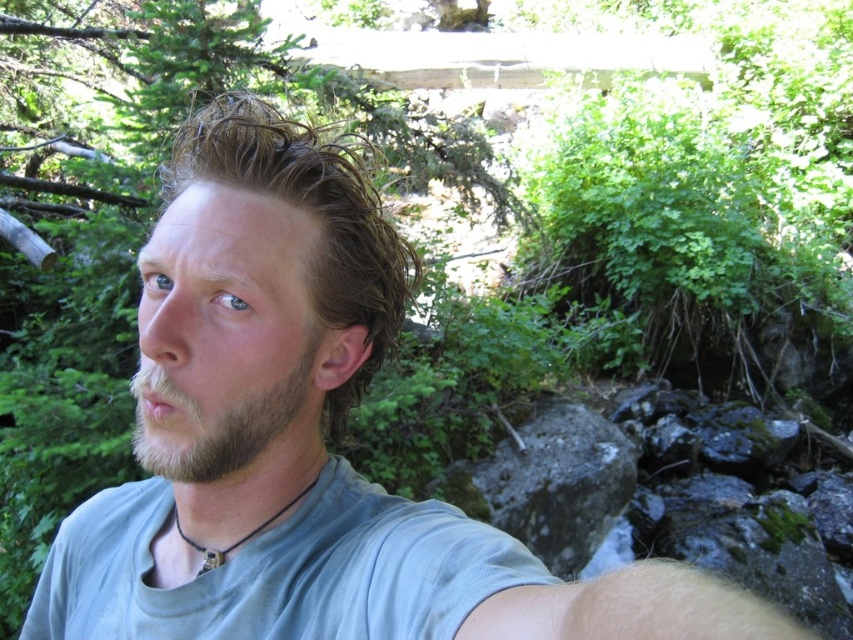
Looking at the person in the selfie, where is the brown fuzzy hair at center in relation to the brown fuzzy beard at lower left?

The brown fuzzy hair at center is located to the left of the brown fuzzy beard at lower left.

You are a photographer trying to focus on the person in the image. Which of the two features, the brown fuzzy hair at center or the brown fuzzy beard at lower left, is positioned higher on the person?

The brown fuzzy hair at center is positioned higher because it is located above the brown fuzzy beard at lower left.

Consider the image. You are a photographer trying to capture the best angle for a portrait. You notice the brown fuzzy hair at center and the brown fuzzy beard at lower left. Which of these two features should you focus on to ensure they are prominently displayed in the frame?

The brown fuzzy hair at center is bigger than the brown fuzzy beard at lower left, so focusing on the brown fuzzy hair at center would ensure it is prominently displayed in the frame.